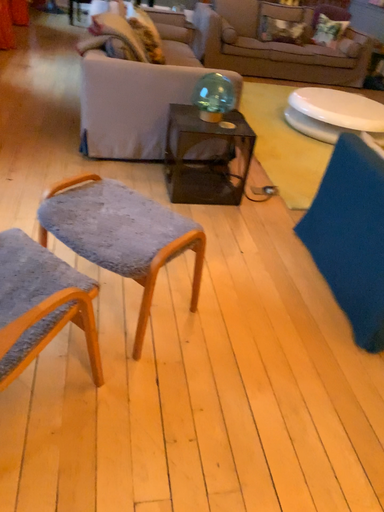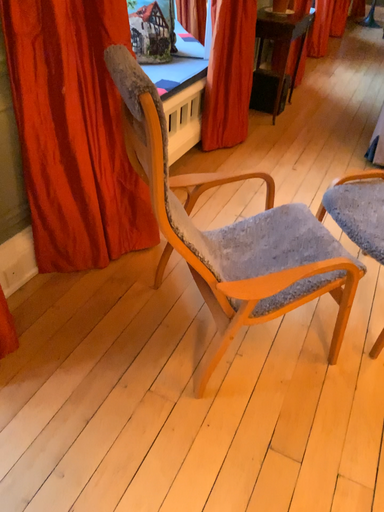
Question: Which way did the camera rotate in the video?

Choices:
 (A) rotated right
 (B) rotated left

Answer: (B)